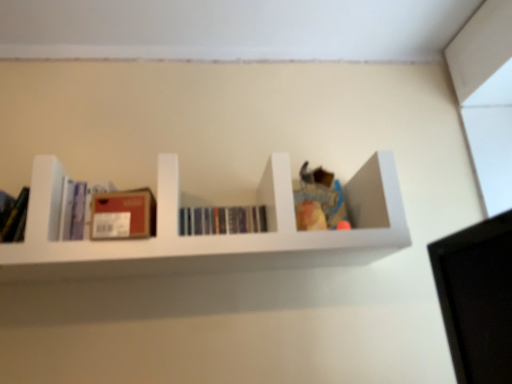
Question: Is matte purple book at left, which is the second book in right-to-left order, closer to the viewer compared to hardcover books at center, the first book in the right-to-left sequence?

Choices:
 (A) yes
 (B) no

Answer: (A)

Question: Is matte purple book at left, the 1th book in the left-to-right sequence, far from hardcover books at center, the 2th book when ordered from left to right?

Choices:
 (A) no
 (B) yes

Answer: (A)

Question: Is matte purple book at left, the 1th book in the left-to-right sequence, facing towards hardcover books at center, the first book in the right-to-left sequence?

Choices:
 (A) no
 (B) yes

Answer: (A)

Question: From a real-world perspective, is matte purple book at left, the 1th book in the left-to-right sequence, over hardcover books at center, the first book in the right-to-left sequence?

Choices:
 (A) yes
 (B) no

Answer: (A)

Question: Is matte purple book at left, the 1th book in the left-to-right sequence, bigger than hardcover books at center, the first book in the right-to-left sequence?

Choices:
 (A) no
 (B) yes

Answer: (B)

Question: From the image's perspective, is matte cardboard box at center left located above or below hardcover books at center, the first book in the right-to-left sequence?

Choices:
 (A) above
 (B) below

Answer: (B)

Question: From a real-world perspective, is matte cardboard box at center left above or below hardcover books at center, the first book in the right-to-left sequence?

Choices:
 (A) below
 (B) above

Answer: (A)

Question: Is matte cardboard box at center left inside or outside of hardcover books at center, the 2th book when ordered from left to right?

Choices:
 (A) outside
 (B) inside

Answer: (A)

Question: Is matte cardboard box at center left to the left or to the right of hardcover books at center, the first book in the right-to-left sequence, in the image?

Choices:
 (A) left
 (B) right

Answer: (A)

Question: From a real-world perspective, is white matte shelf at center above or below hardcover books at center, the first book in the right-to-left sequence?

Choices:
 (A) above
 (B) below

Answer: (B)

Question: Looking at the image, does white matte shelf at center seem bigger or smaller compared to hardcover books at center, the 2th book when ordered from left to right?

Choices:
 (A) small
 (B) big

Answer: (B)

Question: Is point (273, 223) positioned closer to the camera than point (193, 233)?

Choices:
 (A) closer
 (B) farther

Answer: (A)

Question: In the image, is white matte shelf at center on the left side or the right side of hardcover books at center, the first book in the right-to-left sequence?

Choices:
 (A) right
 (B) left

Answer: (B)

Question: Considering the positions of matte cardboard box at center left and matte purple book at left, the 1th book in the left-to-right sequence, in the image, is matte cardboard box at center left wider or thinner than matte purple book at left, the 1th book in the left-to-right sequence,?

Choices:
 (A) thin
 (B) wide

Answer: (B)

Question: In the image, is matte cardboard box at center left positioned in front of or behind matte purple book at left, the 1th book in the left-to-right sequence?

Choices:
 (A) behind
 (B) front

Answer: (B)